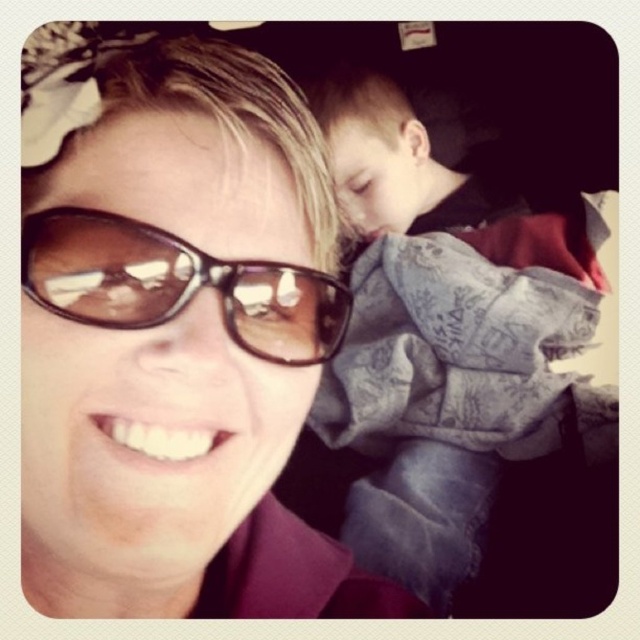
Question: Can you confirm if matte brown sunglasses at upper left is smaller than sunglasses at center?

Choices:
 (A) no
 (B) yes

Answer: (A)

Question: Among these points, which one is farthest from the camera?

Choices:
 (A) (106, 554)
 (B) (342, 376)
 (C) (113, 308)

Answer: (B)

Question: Estimate the real-world distances between objects in this image. Which object is closer to the matte brown sunglasses at upper left?

Choices:
 (A) denim jacket at upper right
 (B) sunglasses at center

Answer: (B)

Question: Based on their relative distances, which object is nearer to the matte brown sunglasses at upper left?

Choices:
 (A) sunglasses at center
 (B) denim jacket at upper right

Answer: (A)

Question: Is the position of matte brown sunglasses at upper left less distant than that of sunglasses at center?

Choices:
 (A) no
 (B) yes

Answer: (B)

Question: Is denim jacket at upper right to the left of sunglasses at center from the viewer's perspective?

Choices:
 (A) yes
 (B) no

Answer: (B)